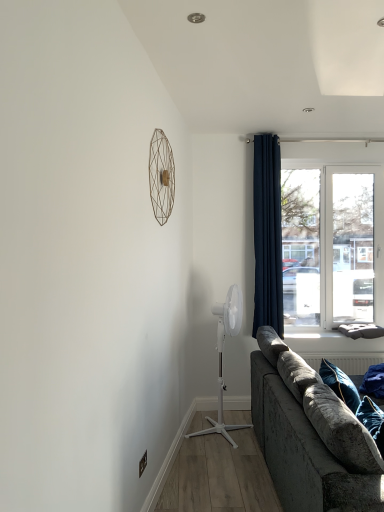
Question: Is matte gold wire at upper center, marked as the 1th mechanical fan in a front-to-back arrangement, aimed at navy blue fabric curtain at right?

Choices:
 (A) no
 (B) yes

Answer: (A)

Question: Does matte gold wire at upper center, the 2th mechanical fan viewed from the back, touch navy blue fabric curtain at right?

Choices:
 (A) yes
 (B) no

Answer: (B)

Question: Can you confirm if matte gold wire at upper center, which ranks as the first mechanical fan in top-to-bottom order, is bigger than navy blue fabric curtain at right?

Choices:
 (A) yes
 (B) no

Answer: (B)

Question: From a real-world perspective, is matte gold wire at upper center, which is the first mechanical fan from left to right, physically below navy blue fabric curtain at right?

Choices:
 (A) no
 (B) yes

Answer: (A)

Question: Does matte gold wire at upper center, the 2th mechanical fan viewed from the back, have a lesser width compared to navy blue fabric curtain at right?

Choices:
 (A) yes
 (B) no

Answer: (A)

Question: Is matte gold wire at upper center, the 2th mechanical fan viewed from the back, looking in the opposite direction of navy blue fabric curtain at right?

Choices:
 (A) yes
 (B) no

Answer: (B)

Question: Does white plastic fan at center, placed as the first mechanical fan when sorted from bottom to top, appear on the right side of navy blue fabric curtain at right?

Choices:
 (A) no
 (B) yes

Answer: (A)

Question: Could you tell me if white plastic fan at center, placed as the first mechanical fan when sorted from bottom to top, is turned towards navy blue fabric curtain at right?

Choices:
 (A) yes
 (B) no

Answer: (B)

Question: Does white plastic fan at center, the 2th mechanical fan viewed from the left, have a greater width compared to navy blue fabric curtain at right?

Choices:
 (A) yes
 (B) no

Answer: (A)

Question: Is white plastic fan at center, which ranks as the first mechanical fan in right-to-left order, bigger than navy blue fabric curtain at right?

Choices:
 (A) yes
 (B) no

Answer: (A)

Question: Is white plastic fan at center, the 2th mechanical fan in the top-to-bottom sequence, closer to camera compared to navy blue fabric curtain at right?

Choices:
 (A) no
 (B) yes

Answer: (B)

Question: From the image's perspective, is white plastic fan at center, which ranks as the first mechanical fan in right-to-left order, below navy blue fabric curtain at right?

Choices:
 (A) yes
 (B) no

Answer: (A)

Question: Would you consider white plastic fan at center, positioned as the second mechanical fan in front-to-back order, to be distant from transparent glass window at upper right?

Choices:
 (A) no
 (B) yes

Answer: (B)